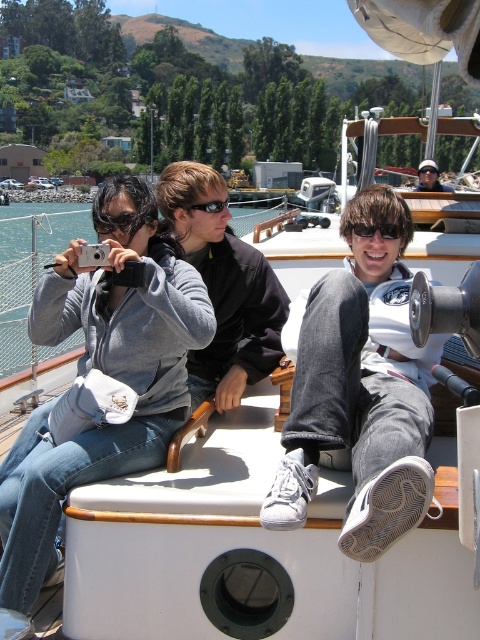
You are a photographer on the boat and want to capture the reflection of the sunglasses in the water. Since reflections are visible only when the object is directly above the water, can you confirm if both the matte black sunglasses at upper right and the black plastic sunglasses at center are positioned above the water?

The matte black sunglasses at upper right is above the black plastic sunglasses at center. Since the black plastic sunglasses at center is likely positioned lower than the water level, its reflection might not be visible. However, the matte black sunglasses at upper right being higher up might have a reflection if it is directly above the water. But without knowing their exact positions relative to the water, it is uncertain.

You are a photographer trying to capture a clear shot of both the dark brown leather jacket at center and the black plastic sunglasses at center. Since you want both items to be fully visible in the frame, which object should you focus on first to ensure it doesn t get cropped out?

The dark brown leather jacket at center is taller than the black plastic sunglasses at center, so you should focus on ensuring the dark brown leather jacket at center is fully in frame first since it is taller and more likely to be partially cropped if not properly framed.